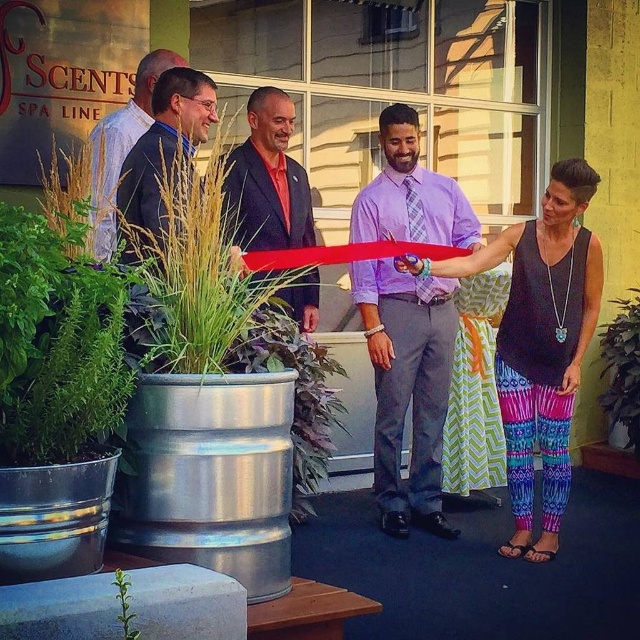
Which person is positioned to the right of the other between the lavender plaid shirt at center and the dark blue suit at upper left?

The lavender plaid shirt at center is positioned to the right of the dark blue suit at upper left.

You are standing at the point marked by the coordinates point [406,387] in the image. What object or feature is located at this point?

The point [406,387] corresponds to the lavender plaid shirt at center.